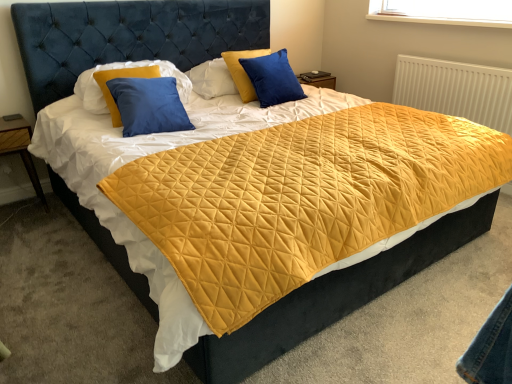
Question: From the image's perspective, is blue velvet pillow at upper center, which ranks as the 2th pillow in left-to-right order, positioned above or below white textured radiator at upper right?

Choices:
 (A) below
 (B) above

Answer: (B)

Question: Visually, is blue velvet pillow at upper center, the first pillow positioned from the right, positioned to the left or to the right of white textured radiator at upper right?

Choices:
 (A) left
 (B) right

Answer: (A)

Question: Estimate the real-world distances between objects in this image. Which object is closer to the white textured radiator at upper right?

Choices:
 (A) wooden at left
 (B) blue velvet pillow at upper center, which ranks as the 2th pillow in left-to-right order
 (C) blue matte pillow at upper left, which appears as the 1th pillow when viewed from the left

Answer: (B)

Question: Which of these objects is positioned farthest from the blue velvet pillow at upper center, which ranks as the 2th pillow in left-to-right order?

Choices:
 (A) white textured radiator at upper right
 (B) wooden at left
 (C) blue matte pillow at upper left, the second pillow from the right

Answer: (B)